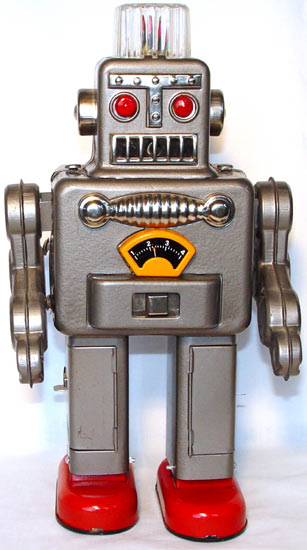
Find the location of a particular element. latch is located at coordinates (159, 307).